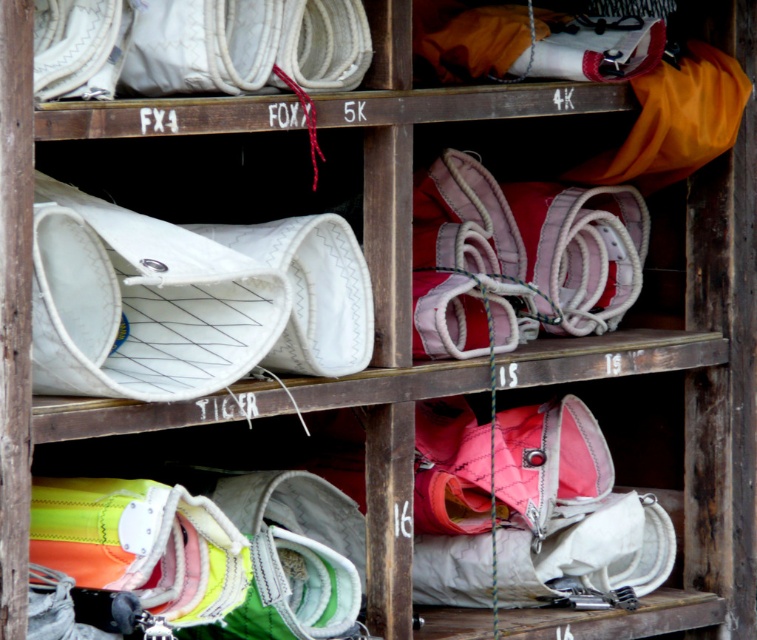
You are a customer in a sports store looking for a pair of shoes. You see a pink fabric shoe at center and a white fabric shoe at center. Which shoe is positioned to the right of the other?

The pink fabric shoe at center is to the right of the white fabric shoe at center.

You are trying to choose between the pink fabric shoe at center and the white fabric shoe at center for your water sports activity. Based on their height, which one would you recommend and why?

The pink fabric shoe at center is taller than the white fabric shoe at center. If you prefer a taller shoe for better ankle support and protection, the pink one would be more suitable. If you prefer a lower profile for flexibility, the white one might be better.